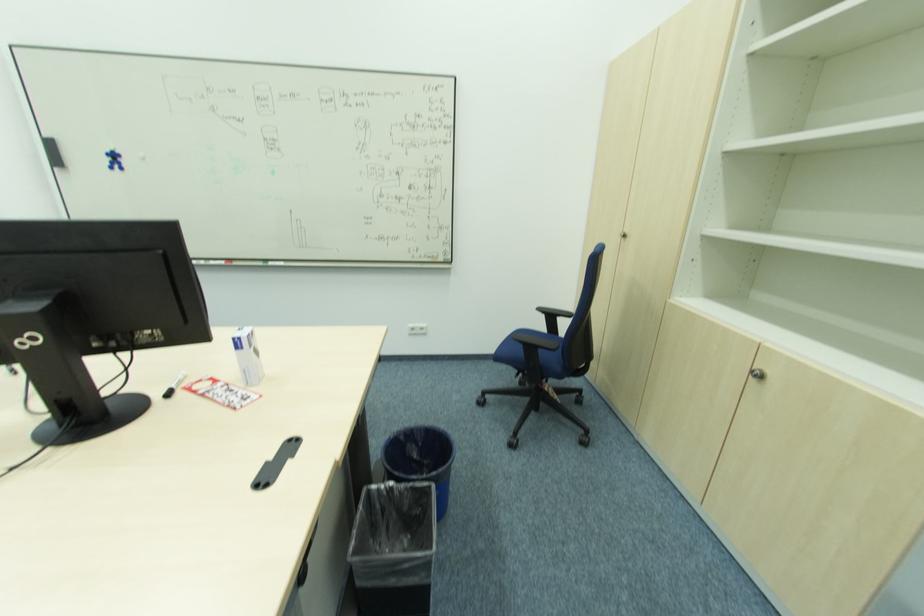
The height and width of the screenshot is (616, 924). What do you see at coordinates (535, 342) in the screenshot? I see `a blue chair sitting surface` at bounding box center [535, 342].